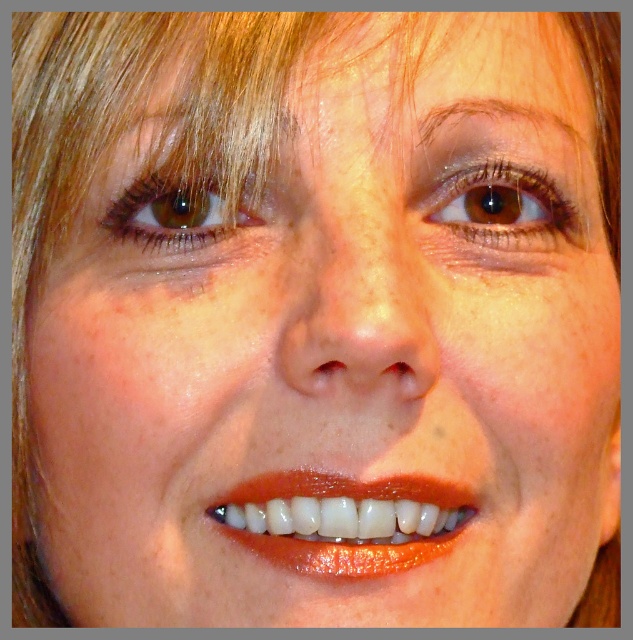
Question: Considering the relative positions of glossy white teeth at center and brown matte eye at upper center in the image provided, where is glossy white teeth at center located with respect to brown matte eye at upper center?

Choices:
 (A) left
 (B) right

Answer: (A)

Question: Which point appears closest to the camera in this image?

Choices:
 (A) (430, 490)
 (B) (458, 209)
 (C) (242, 205)

Answer: (A)

Question: Which point is farther from the camera taking this photo?

Choices:
 (A) (337, 572)
 (B) (425, 204)

Answer: (B)

Question: Based on their relative distances, which object is nearer to the brown matte eye at upper left?

Choices:
 (A) glossy white teeth at center
 (B) brown matte eye at upper center

Answer: (A)

Question: Can you confirm if glossy white teeth at center is positioned to the right of brown matte eye at upper left?

Choices:
 (A) no
 (B) yes

Answer: (B)

Question: Does glossy white teeth at center appear over brown matte eye at upper left?

Choices:
 (A) no
 (B) yes

Answer: (A)